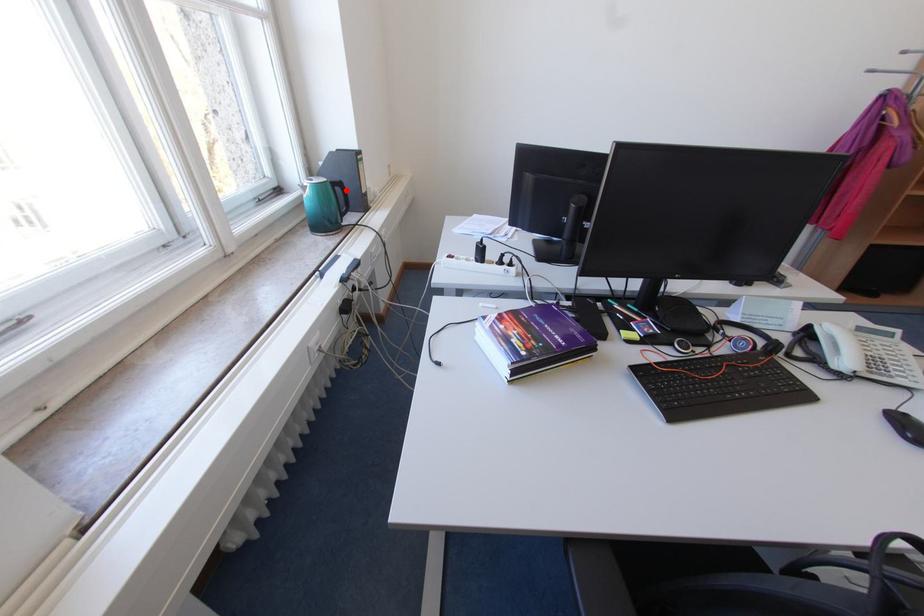
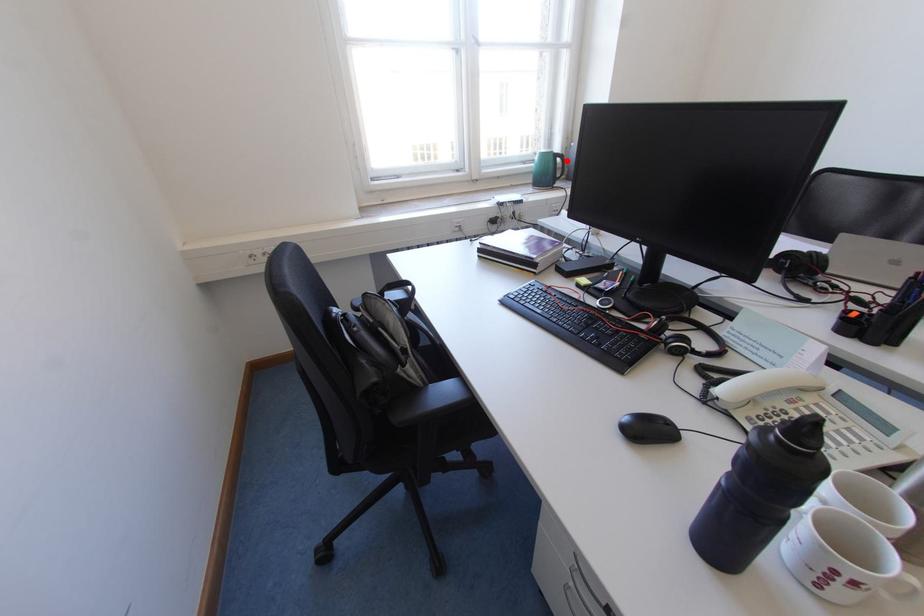
I am providing you with two images of the same scene from different viewpoints. A red point is marked on the first image and another point is marked on the second image. Is the marked point in image1 the same physical position as the marked point in image2?

Yes